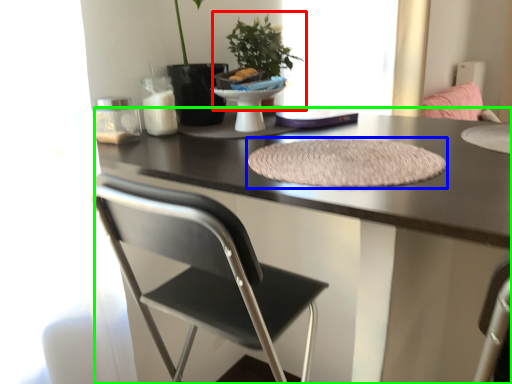
Question: Considering the real-world distances, which object is closest to houseplant (highlighted by a red box)? mat (highlighted by a blue box) or desk (highlighted by a green box).

Choices:
 (A) mat
 (B) desk

Answer: (A)